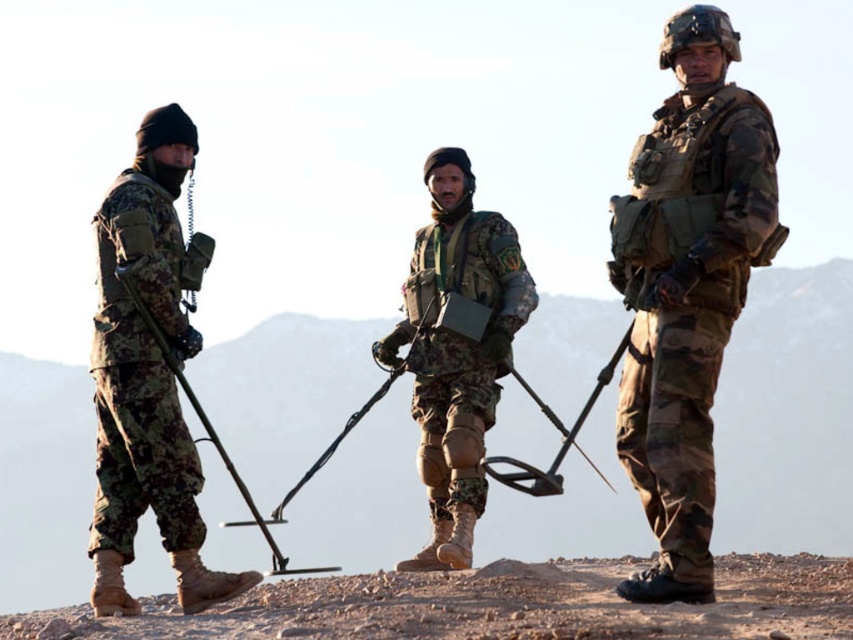
Does camo fabric uniform at right have a greater width compared to camouflage fabric uniform at left?

Yes.

Between point (647, 417) and point (134, 252), which one is positioned in front?

Positioned in front is point (647, 417).

Where is `camo fabric uniform at right`? The image size is (853, 640). camo fabric uniform at right is located at coordinates (688, 300).

Does camouflage fabric uniform at left have a smaller size compared to camouflage fabric vest at center?

Yes, camouflage fabric uniform at left is smaller than camouflage fabric vest at center.

In the scene shown: Who is more distant from viewer, (151, 218) or (453, 344)?

The point (453, 344) is behind.

Who is more forward, (175, 497) or (461, 444)?

Point (175, 497) is in front.

This screenshot has height=640, width=853. Find the location of `camouflage fabric uniform at left`. camouflage fabric uniform at left is located at coordinates (140, 378).

Does camo fabric uniform at right lie in front of camouflage fabric vest at center?

Yes, it is.

Can you confirm if camo fabric uniform at right is bigger than camouflage fabric vest at center?

No.

Is point (695, 102) positioned in front of point (450, 243)?

Yes, point (695, 102) is closer to viewer.

Where is `camo fabric uniform at right`? camo fabric uniform at right is located at coordinates pos(688,300).